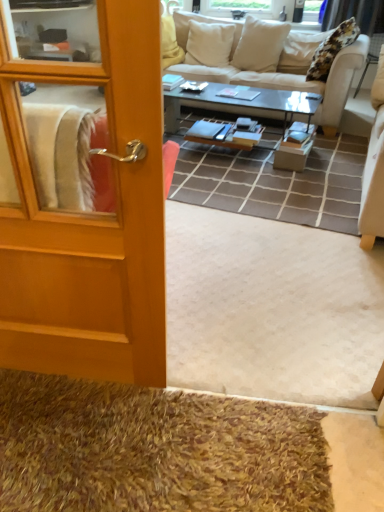
Question: Considering the relative positions of shaggy brown doormat at lower left and wooden door at left in the image provided, is shaggy brown doormat at lower left to the right of wooden door at left from the viewer's perspective?

Choices:
 (A) no
 (B) yes

Answer: (B)

Question: Can you confirm if shaggy brown doormat at lower left is wider than wooden door at left?

Choices:
 (A) no
 (B) yes

Answer: (B)

Question: From a real-world perspective, is shaggy brown doormat at lower left on top of wooden door at left?

Choices:
 (A) yes
 (B) no

Answer: (B)

Question: Does shaggy brown doormat at lower left have a smaller size compared to wooden door at left?

Choices:
 (A) yes
 (B) no

Answer: (A)

Question: Is shaggy brown doormat at lower left at the left side of wooden door at left?

Choices:
 (A) no
 (B) yes

Answer: (A)

Question: In the image, is shaggy brown doormat at lower left positioned in front of or behind beige fabric couch at upper center?

Choices:
 (A) behind
 (B) front

Answer: (B)

Question: From the image's perspective, is shaggy brown doormat at lower left located above or below beige fabric couch at upper center?

Choices:
 (A) above
 (B) below

Answer: (B)

Question: Visually, is shaggy brown doormat at lower left positioned to the left or to the right of beige fabric couch at upper center?

Choices:
 (A) left
 (B) right

Answer: (A)

Question: Based on their sizes in the image, would you say shaggy brown doormat at lower left is bigger or smaller than beige fabric couch at upper center?

Choices:
 (A) big
 (B) small

Answer: (B)

Question: From a real-world perspective, is shaggy brown doormat at lower left above or below wooden door at left?

Choices:
 (A) above
 (B) below

Answer: (B)

Question: From the image's perspective, relative to wooden door at left, is shaggy brown doormat at lower left above or below?

Choices:
 (A) above
 (B) below

Answer: (B)

Question: Do you think shaggy brown doormat at lower left is within wooden door at left, or outside of it?

Choices:
 (A) inside
 (B) outside

Answer: (B)

Question: Considering the positions of shaggy brown doormat at lower left and wooden door at left in the image, is shaggy brown doormat at lower left taller or shorter than wooden door at left?

Choices:
 (A) tall
 (B) short

Answer: (B)

Question: Is wooden door at left situated inside black glass coffee table at center or outside?

Choices:
 (A) outside
 (B) inside

Answer: (A)

Question: From a real-world perspective, relative to black glass coffee table at center, is wooden door at left vertically above or below?

Choices:
 (A) below
 (B) above

Answer: (B)